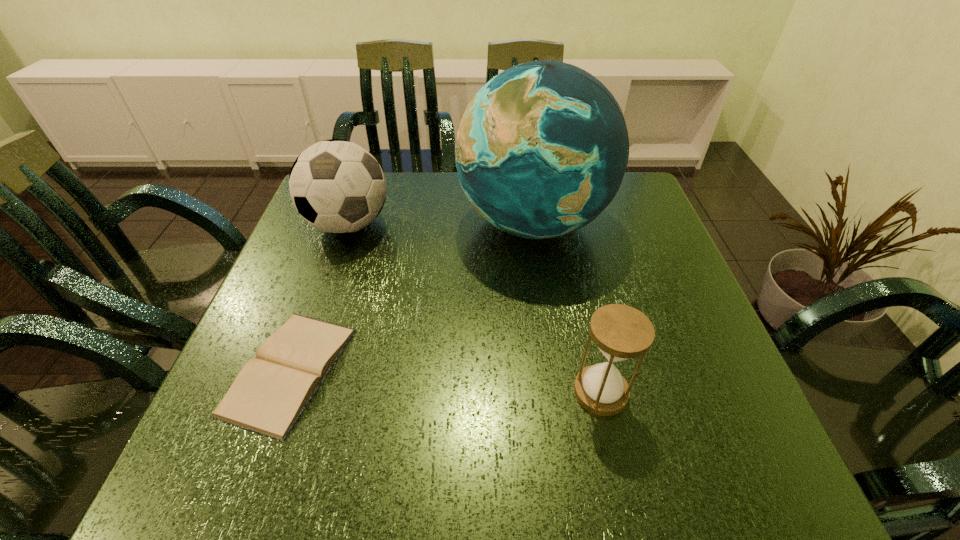
This screenshot has width=960, height=540. In order to click on globe in this screenshot , I will do `click(542, 148)`.

Locate an element on the screen. This screenshot has height=540, width=960. the third shortest object is located at coordinates (337, 186).

This screenshot has height=540, width=960. In order to click on the third tallest object in this screenshot , I will do `click(621, 332)`.

You are a GUI agent. You are given a task and a screenshot of the screen. Output one action in this format:
    pyautogui.click(x=<x>, y=<y>)
    Task: Click on the shortest object
    Image resolution: width=960 pixels, height=540 pixels.
    Given the screenshot: What is the action you would take?
    pyautogui.click(x=271, y=391)

Find the location of a particular element. The image size is (960, 540). free spot located 0.140m on the left of the tallest object is located at coordinates pos(403,222).

Find the location of a particular element. vacant space located 0.150m on the main logo of the soccer ball is located at coordinates (323, 299).

Locate an element on the screen. The width and height of the screenshot is (960, 540). vacant position located 0.180m on the back of the second shortest object is located at coordinates (580, 298).

At what (x,y) coordinates should I click in order to perform the action: click on vacant area situated on the back of the Bible. Please return your answer as a coordinate pair (x, y). The height and width of the screenshot is (540, 960). Looking at the image, I should click on (347, 216).

Find the location of `globe located at the far edge`. globe located at the far edge is located at coordinates (542, 148).

Where is `soccer ball present at the far edge`? soccer ball present at the far edge is located at coordinates [337, 186].